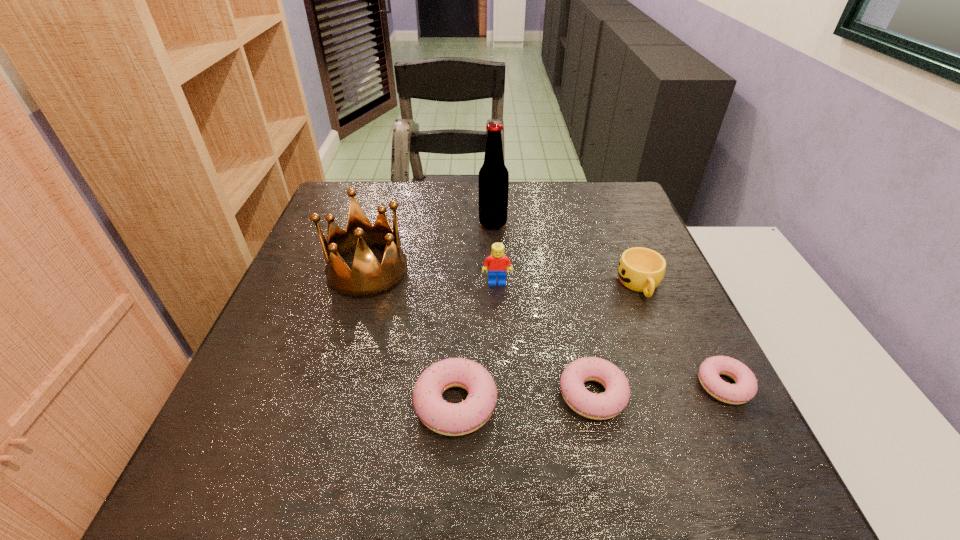
Please point a spot on the left to add another doughnut. Please provide its 2D coordinates. Your answer should be formatted as a tuple, i.e. [(x, y)], where the tuple contains the x and y coordinates of a point satisfying the conditions above.

[(314, 414)]